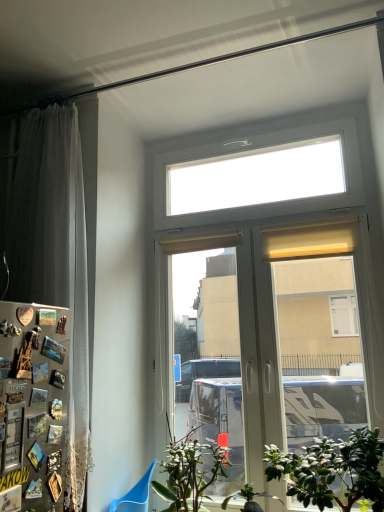
Question: From a real-world perspective, is blue plastic armchair at lower left above or below green leafy plant at lower center, which is the second houseplant from right to left?

Choices:
 (A) below
 (B) above

Answer: (A)

Question: Choose the correct answer: Is blue plastic armchair at lower left inside green leafy plant at lower center, the 2th houseplant positioned from the left, or outside it?

Choices:
 (A) outside
 (B) inside

Answer: (A)

Question: Which of these objects is positioned farthest from the metallic silver fridge at left?

Choices:
 (A) white sheer curtain at left
 (B) green leafy plant at lower center, which is the second houseplant from right to left
 (C) blue plastic armchair at lower left
 (D) white plastic window at center
 (E) green matte plant at lower center, which is the 1th houseplant from left to right

Answer: (D)

Question: Based on their relative distances, which object is nearer to the blue plastic armchair at lower left?

Choices:
 (A) green leafy plant at lower right, the 1th houseplant in the right-to-left sequence
 (B) green matte plant at lower center, the third houseplant positioned from the right
 (C) white plastic window at center
 (D) green leafy plant at lower center, which is the second houseplant from right to left
 (E) metallic silver fridge at left

Answer: (B)